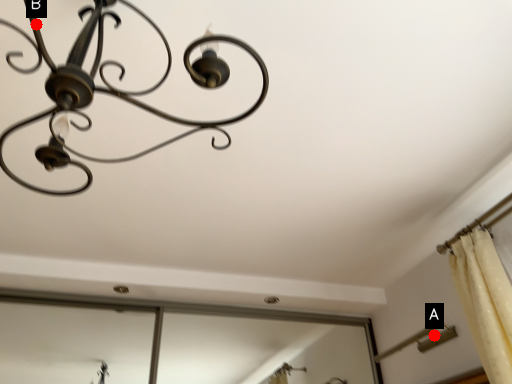
Question: Two points are circled on the image, labeled by A and B beside each circle. Which point is closer to the camera taking this photo?

Choices:
 (A) A is closer
 (B) B is closer

Answer: (B)